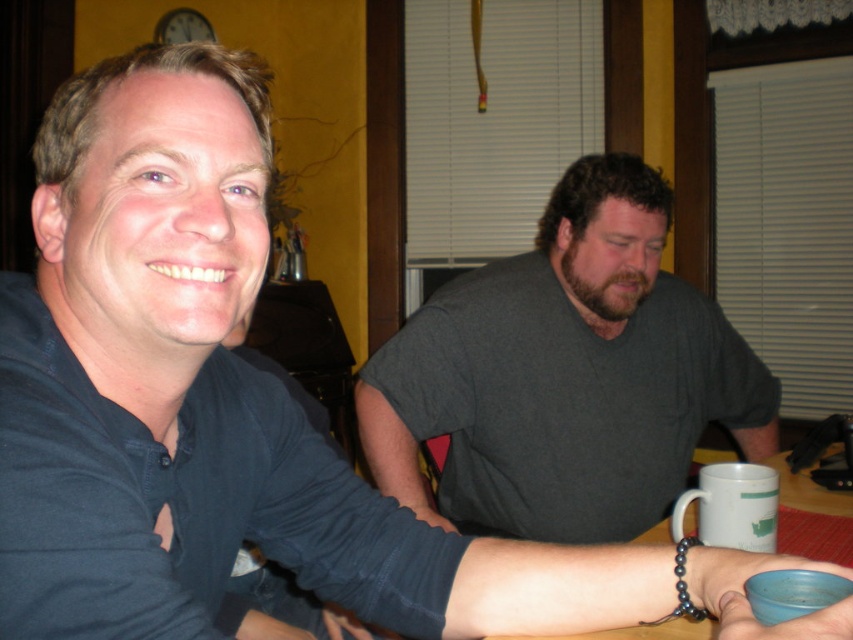
Question: Which of the following is the closest to the observer?

Choices:
 (A) (660, 532)
 (B) (759, 512)
 (C) (555, 346)

Answer: (B)

Question: Can you confirm if white matte mug at lower right is positioned to the right of wooden table at lower right?

Choices:
 (A) yes
 (B) no

Answer: (B)

Question: Which object appears closest to the camera in this image?

Choices:
 (A) wooden table at lower right
 (B) white matte mug at lower right

Answer: (B)

Question: Which point is farther to the camera?

Choices:
 (A) gray matte shirt at center
 (B) white matte mug at lower right

Answer: (A)

Question: Can you confirm if gray matte shirt at center is positioned above white matte mug at lower right?

Choices:
 (A) no
 (B) yes

Answer: (B)

Question: Is white matte mug at lower right to the left of wooden table at lower right from the viewer's perspective?

Choices:
 (A) yes
 (B) no

Answer: (A)